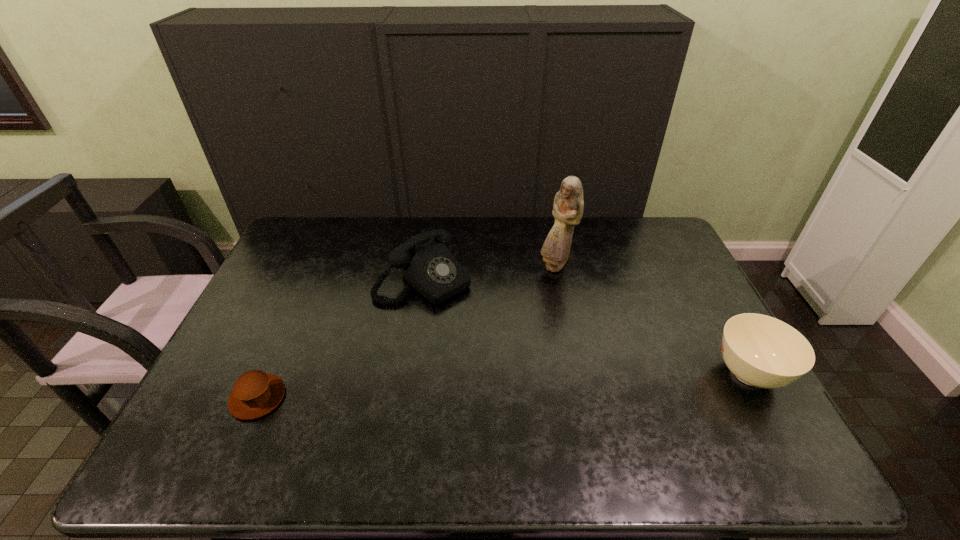
Identify the location of blank area in the image that satisfies the following two spatial constraints: 1. on the front side of the rightmost object; 2. on the right side of the telephone. [x=410, y=374].

Locate an element on the screen. free space that satisfies the following two spatial constraints: 1. on the back side of the figurine; 2. on the left side of the third object from right to left is located at coordinates 425,266.

Locate an element on the screen. The image size is (960, 540). free space that satisfies the following two spatial constraints: 1. on the front side of the rightmost object; 2. on the left side of the telephone is located at coordinates (410, 374).